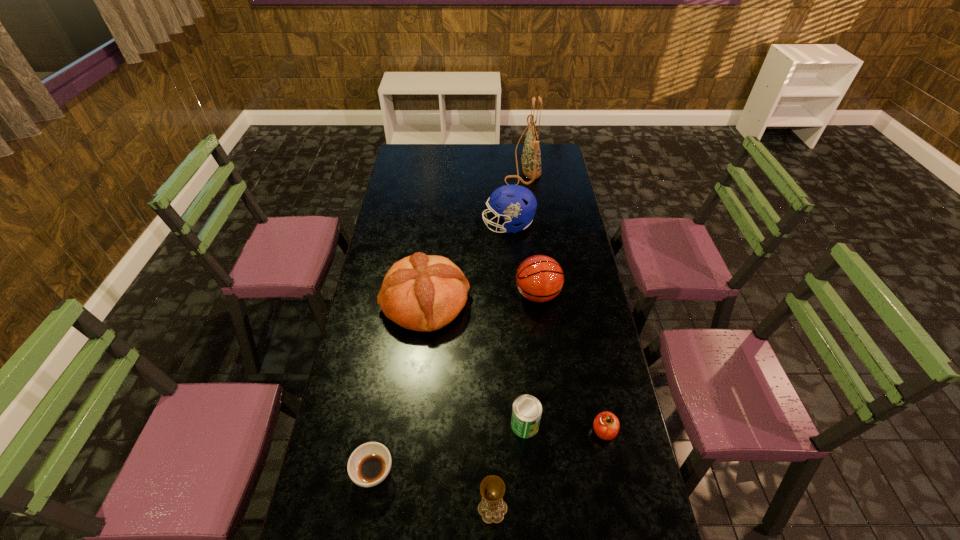
At what (x,y) coordinates should I click in order to perform the action: click on vacant region at the left edge of the desktop. Please return your answer as a coordinate pair (x, y). The image size is (960, 540). Looking at the image, I should click on (344, 418).

The image size is (960, 540). I want to click on vacant region at the right edge of the desktop, so click(547, 171).

Where is `vacant space at the far left corner of the desktop`? vacant space at the far left corner of the desktop is located at coordinates (423, 163).

Identify the location of vacant region at the far right corner of the desktop. (561, 166).

At what (x,y) coordinates should I click in order to perform the action: click on free area in between the apple and the second farthest object. Please return your answer as a coordinate pair (x, y). The height and width of the screenshot is (540, 960). Looking at the image, I should click on (556, 328).

Where is `vacant area that lies between the basketball and the apple`? The height and width of the screenshot is (540, 960). vacant area that lies between the basketball and the apple is located at coordinates (571, 363).

Where is `empty location between the soup bowl and the bread`? The image size is (960, 540). empty location between the soup bowl and the bread is located at coordinates (399, 387).

Identify the location of free space between the soup bowl and the fourth shortest object. Image resolution: width=960 pixels, height=540 pixels. (433, 490).

Identify the location of vacant area that lies between the rightmost object and the can. This screenshot has height=540, width=960. (564, 428).

This screenshot has width=960, height=540. Find the location of `vacant space that is in between the second farthest object and the fifth tallest object`. vacant space that is in between the second farthest object and the fifth tallest object is located at coordinates (500, 367).